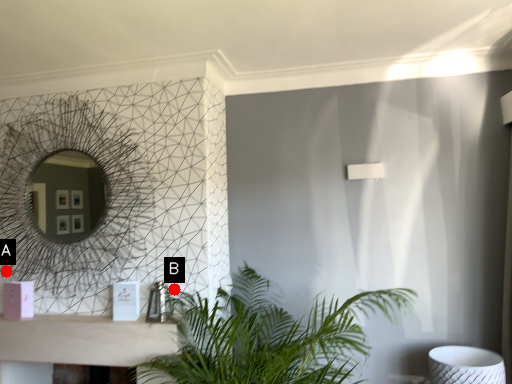
Question: Two points are circled on the image, labeled by A and B beside each circle. Which of the following is the farthest from the observer?

Choices:
 (A) A is further
 (B) B is further

Answer: (A)